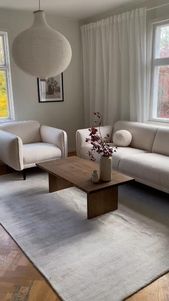
The width and height of the screenshot is (169, 301). I want to click on ornamental light, so click(x=33, y=48).